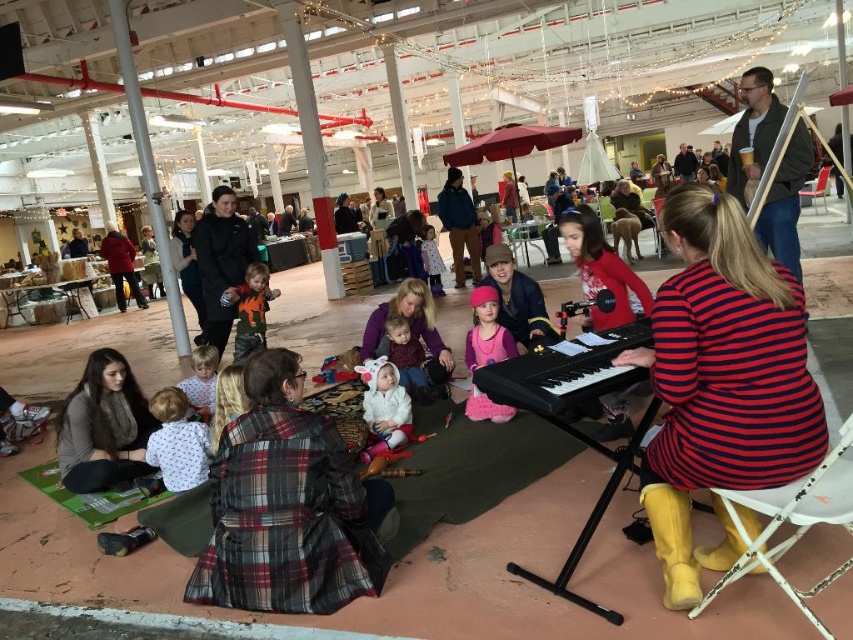
Question: Can you confirm if red striped dress at center is smaller than matte black jacket at center?

Choices:
 (A) yes
 (B) no

Answer: (B)

Question: Which of the following is the closest to the observer?

Choices:
 (A) matte black jacket at center
 (B) pink fuzzy boots at center
 (C) dark gray sweater at lower left
 (D) matte purple sweater at center

Answer: (C)

Question: Which of the following is the closest to the observer?

Choices:
 (A) (473, 342)
 (B) (544, 390)
 (C) (631, 275)

Answer: (B)

Question: Among these objects, which one is nearest to the camera?

Choices:
 (A) matte black jacket at center
 (B) dark gray sweater at lower left
 (C) plaid fabric at center

Answer: (C)

Question: Observing the image, what is the correct spatial positioning of dark gray sweater at lower left in reference to matte black jacket at center?

Choices:
 (A) above
 (B) below

Answer: (B)

Question: Is orange fabric dinosaur at center bigger than light pink fabric dress at center?

Choices:
 (A) no
 (B) yes

Answer: (B)